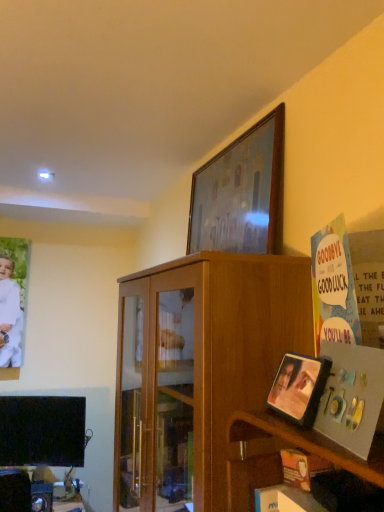
Question: From the image's perspective, is wooden photo frame at lower right, placed as the second picture frame when sorted from top to bottom, on top of white matte clothing at left?

Choices:
 (A) no
 (B) yes

Answer: (B)

Question: Is wooden photo frame at lower right, which is the 2th picture frame in back-to-front order, outside white matte clothing at left?

Choices:
 (A) no
 (B) yes

Answer: (B)

Question: Does wooden photo frame at lower right, placed as the second picture frame when sorted from top to bottom, have a greater height compared to white matte clothing at left?

Choices:
 (A) yes
 (B) no

Answer: (B)

Question: Can you confirm if wooden photo frame at lower right, marked as the 1th picture frame in a bottom-to-top arrangement, is positioned to the right of white matte clothing at left?

Choices:
 (A) yes
 (B) no

Answer: (A)

Question: Is wooden photo frame at lower right, marked as the 1th picture frame in a bottom-to-top arrangement, far from white matte clothing at left?

Choices:
 (A) yes
 (B) no

Answer: (A)

Question: Is wooden photo frame at lower right, placed as the second picture frame when sorted from top to bottom, to the left of white matte clothing at left from the viewer's perspective?

Choices:
 (A) yes
 (B) no

Answer: (B)

Question: From a real-world perspective, is white paper at right under wooden photo frame at lower right, placed as the second picture frame when sorted from top to bottom?

Choices:
 (A) yes
 (B) no

Answer: (B)

Question: Is white paper at right wider than wooden photo frame at lower right, which appears as the 1th picture frame when viewed from the front?

Choices:
 (A) no
 (B) yes

Answer: (A)

Question: Is white paper at right positioned in front of wooden photo frame at lower right, which appears as the 1th picture frame when viewed from the front?

Choices:
 (A) no
 (B) yes

Answer: (B)

Question: Is white paper at right not inside wooden photo frame at lower right, which is the 2th picture frame in back-to-front order?

Choices:
 (A) yes
 (B) no

Answer: (A)

Question: Is white paper at right next to wooden photo frame at lower right, which is the 2th picture frame in back-to-front order?

Choices:
 (A) yes
 (B) no

Answer: (A)

Question: Can you confirm if white paper at right is thinner than wooden photo frame at lower right, which is the 2th picture frame in back-to-front order?

Choices:
 (A) no
 (B) yes

Answer: (B)

Question: Is wooden picture frame at upper center, placed as the 2th picture frame when sorted from front to back, at the back of wooden shelf at lower right?

Choices:
 (A) yes
 (B) no

Answer: (B)